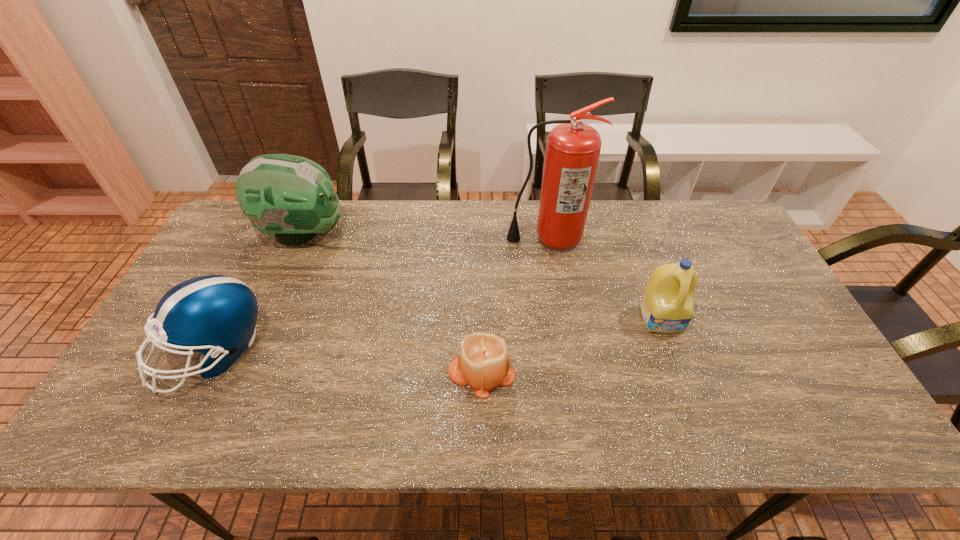
You are a GUI agent. You are given a task and a screenshot of the screen. Output one action in this format:
    pyautogui.click(x=<x>, y=<y>)
    Task: Click on the free location that satisfies the following two spatial constraints: 1. on the visor of the farther football helmet; 2. at the front of the shorter football helmet with the faceguard
    
    Given the screenshot: What is the action you would take?
    pyautogui.click(x=252, y=352)